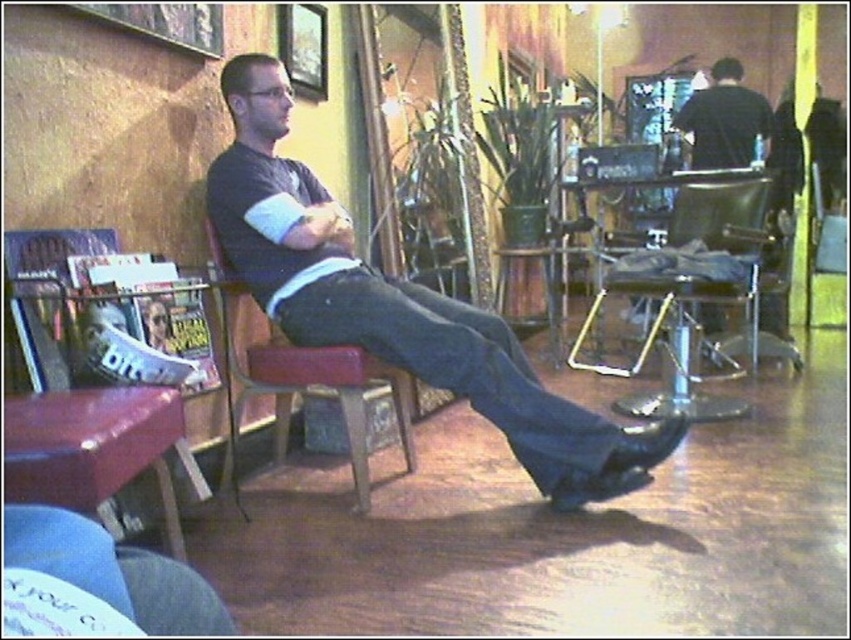
You are a customer entering the barbershop and see the black fabric barber chair at upper right and the matte black shoe at lower center. Which object is located to the right of the other?

The black fabric barber chair at upper right is positioned on the right side of matte black shoe at lower center, so the barber chair is to the right of the shoe.

You are a customer entering the barbershop and see the black fabric barber chair at upper right and the matte black shoe at lower center. If you want to sit in the chair, how many steps would you need to take from the shoe to reach the chair?

The black fabric barber chair at upper right and matte black shoe at lower center are 3.04 meters apart. Assuming an average step length of about 0.76 meters, you would need approximately 4 steps to reach the chair.